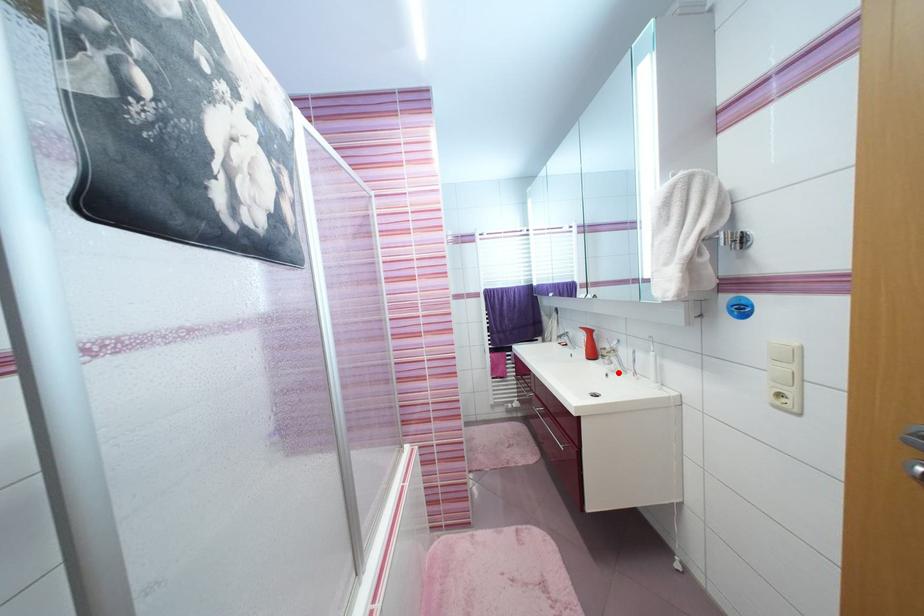
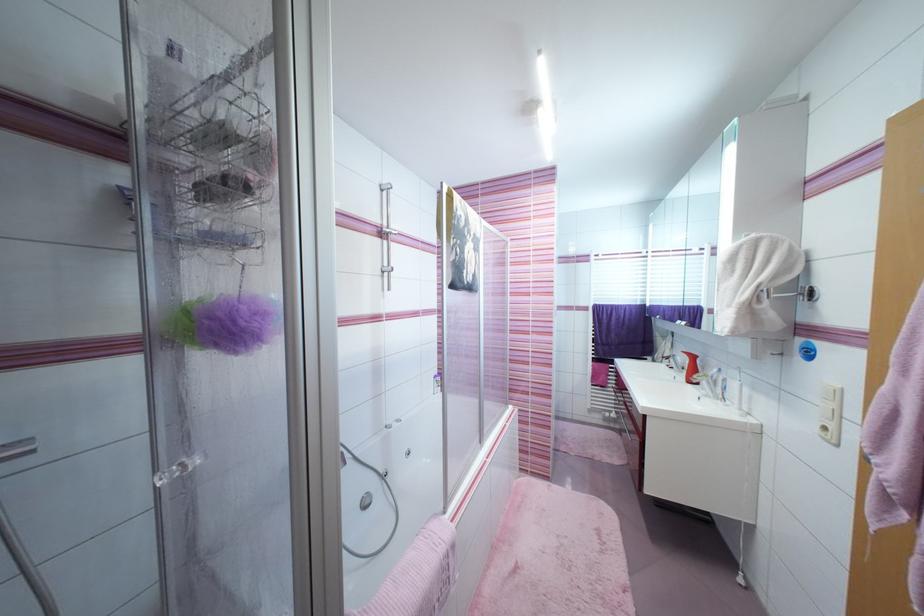
Find the pixel in the second image that matches the highlighted location in the first image.

(711, 398)